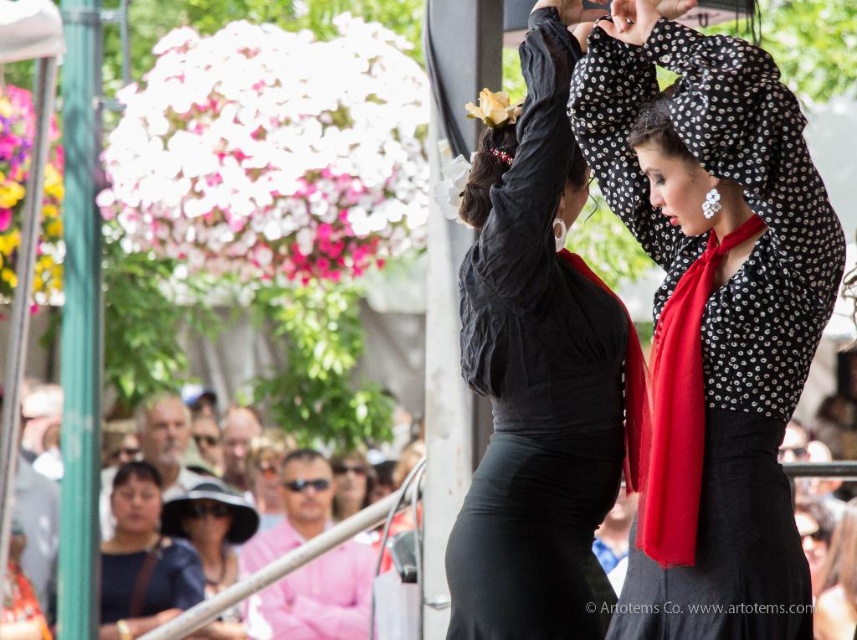
Can you confirm if polka dot blouse at center is positioned above black satin dress at center?

No.

Between point (801, 316) and point (522, 541), which one is positioned in front?

Point (801, 316) is more forward.

Between point (680, 246) and point (594, 484), which one is positioned in front?

Point (680, 246)

Identify the location of polka dot blouse at center. The image size is (857, 640). (712, 314).

Is matte black dress at lower left to the left of matte black sunglasses at lower center from the viewer's perspective?

Correct, you'll find matte black dress at lower left to the left of matte black sunglasses at lower center.

In the scene shown: Does matte black dress at lower left have a lesser width compared to matte black sunglasses at lower center?

Correct, matte black dress at lower left's width is less than matte black sunglasses at lower center's.

Is point (136, 625) positioned after point (360, 513)?

Yes, it is.

This screenshot has height=640, width=857. Identify the location of matte black dress at lower left. (142, 560).

Does point (819, 228) lie behind point (178, 540)?

No, (819, 228) is in front of (178, 540).

Is polka dot blouse at center shorter than matte black dress at lower left?

In fact, polka dot blouse at center may be taller than matte black dress at lower left.

Does point (682, 310) come in front of point (196, 564)?

That is True.

In order to click on polka dot blouse at center in this screenshot , I will do `click(712, 314)`.